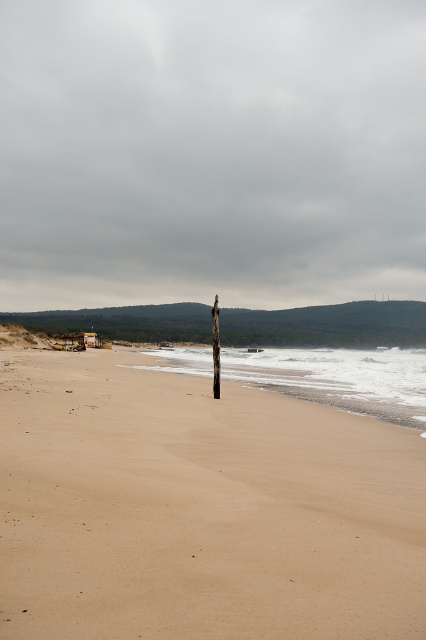
You are a lifeguard on duty and you see a swimmer in distress at the smooth sand shoreline at center. You need to reach them quickly. The brown wooden telegraph pole at center is between you and the shoreline. Can you safely navigate around the pole to reach the shoreline?

The distance between the smooth sand shoreline at center and the brown wooden telegraph pole at center is 39.83 meters, so yes, you can safely navigate around the pole to reach the shoreline since there is sufficient space between them.

You are standing on the smooth sand shoreline at center and want to see the brown wooden telegraph pole at center. Is the pole visible from your current position?

The smooth sand shoreline at center has a greater height compared to the brown wooden telegraph pole at center, so the pole might be partially or fully obscured by the higher shoreline.